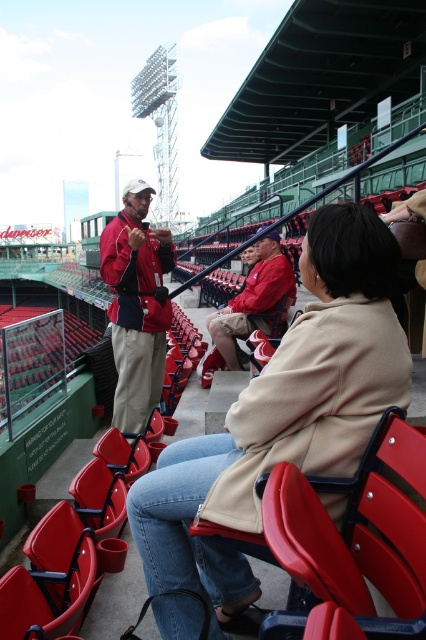
Can you confirm if matte red jacket at center is positioned above red fabric jacket at center?

Incorrect, matte red jacket at center is not positioned above red fabric jacket at center.

Does point (115, 257) lie in front of point (226, 321)?

That is True.

Locate an element on the screen. The image size is (426, 640). matte red jacket at center is located at coordinates (137, 305).

Can you confirm if matte plastic chair at lower center is positioned to the left of red fabric jacket at center?

No, matte plastic chair at lower center is not to the left of red fabric jacket at center.

In the scene shown: Does matte plastic chair at lower center have a lesser height compared to red fabric jacket at center?

Indeed, matte plastic chair at lower center has a lesser height compared to red fabric jacket at center.

Find the location of `matte plastic chair at lower center`. matte plastic chair at lower center is located at coordinates point(379,532).

Does point (397, 548) come in front of point (111, 227)?

Yes, it is in front of point (111, 227).

The height and width of the screenshot is (640, 426). What do you see at coordinates (379, 532) in the screenshot?
I see `matte plastic chair at lower center` at bounding box center [379, 532].

Locate an element on the screen. This screenshot has height=640, width=426. matte plastic chair at lower center is located at coordinates (379, 532).